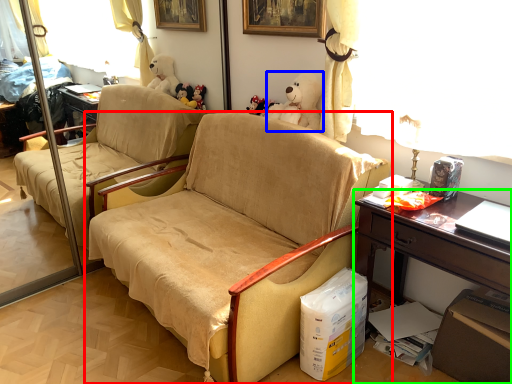
Question: Which object is the farthest from chair (highlighted by a red box)? Choose among these: toy (highlighted by a blue box) or desk (highlighted by a green box).

Choices:
 (A) toy
 (B) desk

Answer: (A)